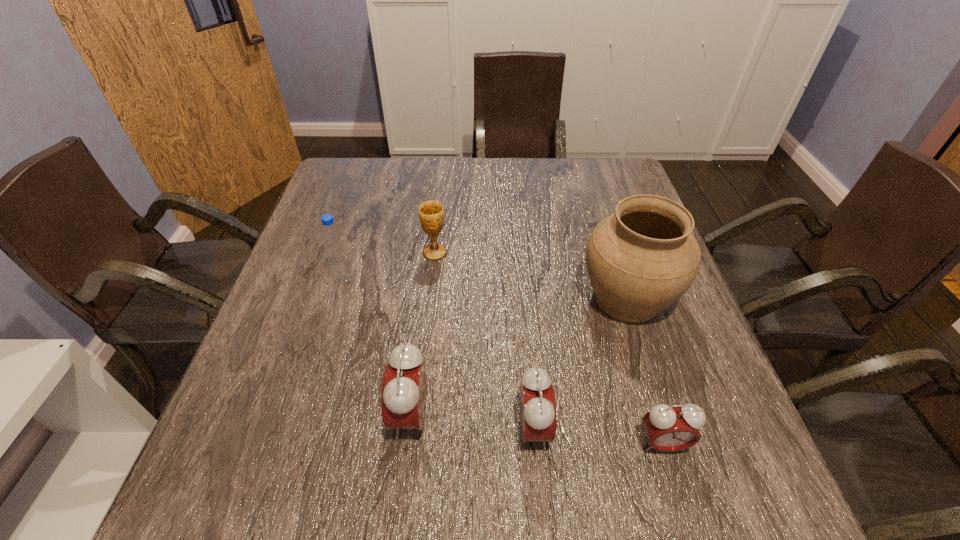
Where is `the leftmost alarm clock`? The width and height of the screenshot is (960, 540). the leftmost alarm clock is located at coordinates (404, 390).

The image size is (960, 540). What are the coordinates of `the second tallest alarm clock` in the screenshot? It's located at (537, 406).

I want to click on the second alarm clock from right to left, so click(537, 406).

You are a GUI agent. You are given a task and a screenshot of the screen. Output one action in this format:
    pyautogui.click(x=<x>, y=<y>)
    Task: Click on the rightmost alarm clock
    This screenshot has height=540, width=960.
    Given the screenshot: What is the action you would take?
    pyautogui.click(x=669, y=428)

Find the location of a particular element. urn is located at coordinates (640, 260).

The height and width of the screenshot is (540, 960). In order to click on chalice in this screenshot , I will do `click(431, 212)`.

This screenshot has height=540, width=960. What are the coordinates of `water bottle` in the screenshot? It's located at (332, 238).

Identify the location of vacant space located 0.050m on the clock face of the leftmost alarm clock. The height and width of the screenshot is (540, 960). [x=367, y=415].

Identify the location of free point located 0.180m on the clock face of the leftmost alarm clock. Image resolution: width=960 pixels, height=540 pixels. (295, 415).

Identify the location of free space located 0.160m on the clock face of the leftmost alarm clock. (306, 415).